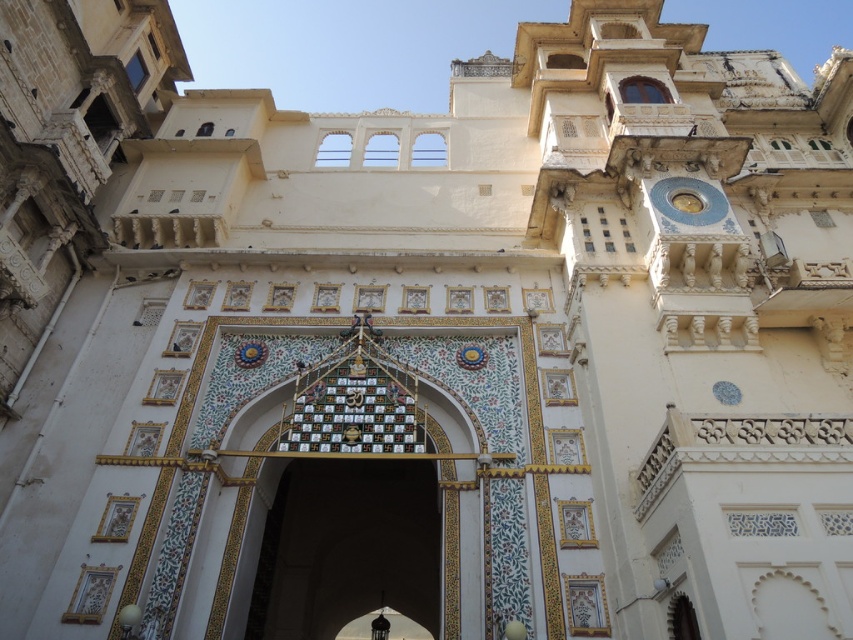
Is point (386, 518) behind point (668, 202)?

Yes, it is behind point (668, 202).

Who is taller, white marble archway at center or gold metallic clock at upper right?

Standing taller between the two is white marble archway at center.

Is point (312, 497) less distant than point (711, 205)?

No, (312, 497) is behind (711, 205).

Where is `white marble archway at center`? This screenshot has width=853, height=640. white marble archway at center is located at coordinates (347, 547).